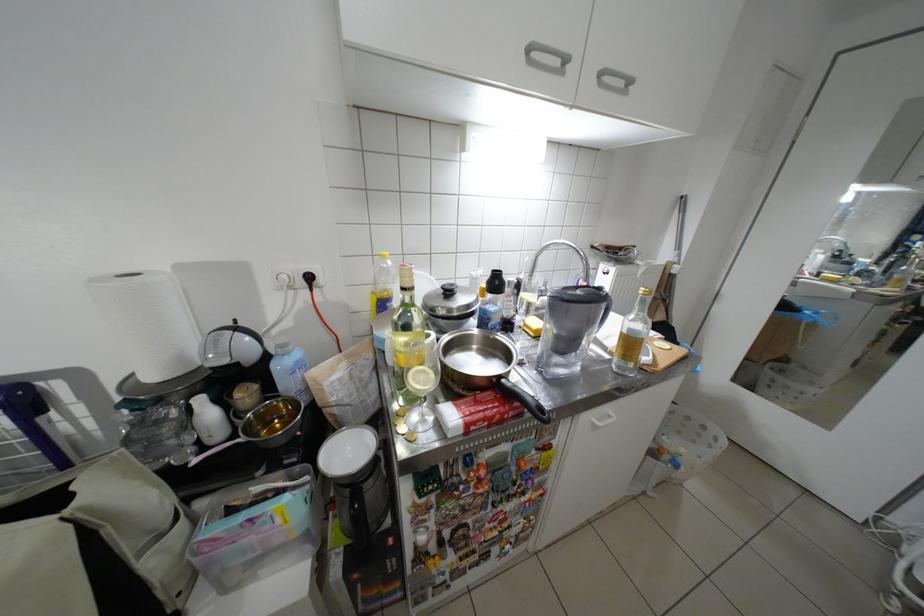
The width and height of the screenshot is (924, 616). I want to click on wine glass, so click(x=419, y=398).